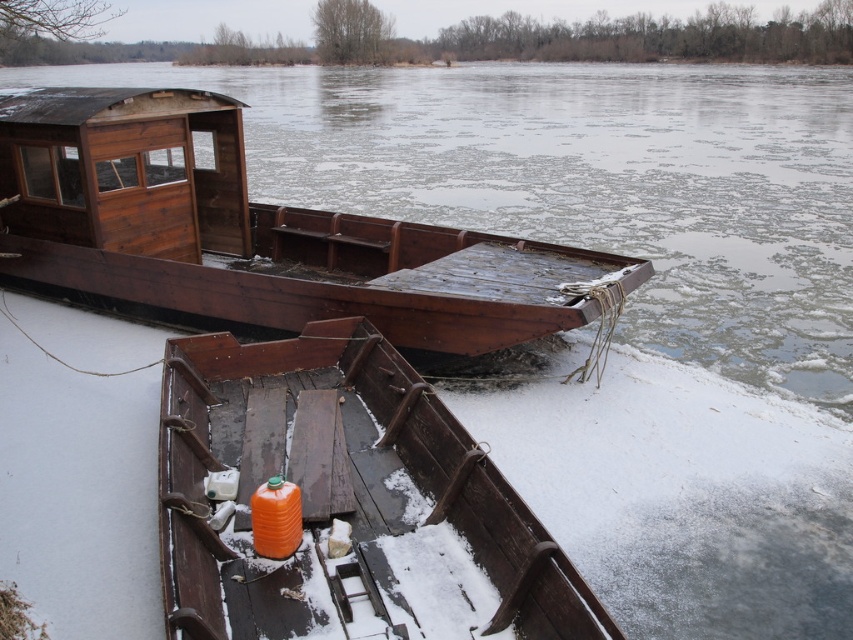
You are a winter explorer who needs to retrieve the orange matte plastic container at center from the frozen river. Given the coordinates provided, can you determine if it is positioned closer to the front or the back of the boat it is on?

The orange matte plastic container at center is located at point (344, 502). Since the coordinates are based on the boat, the x and y values would indicate its position relative to the boat. Typically, coordinates in such contexts might have (0, 0) at the front or back. However, without explicit coordinate system details, it is impossible to definitively determine if it is closer to the front or back. Please provide more information about the coordinate system used.

You are an observer standing on the frozen river. You see the orange matte plastic container at center and the wooden boat at center. Which object is closer to the river surface?

The orange matte plastic container at center is located below wooden boat at center, so it is closer to the river surface than the wooden boat at center.